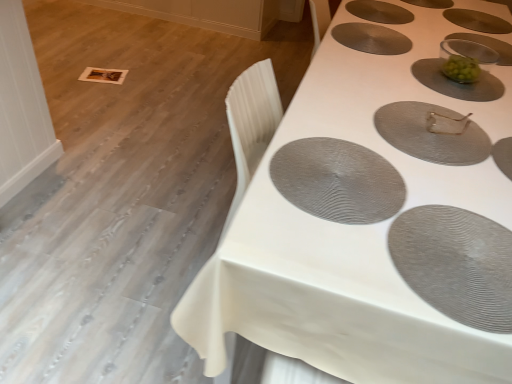
Question: Based on their positions, is green matte bowl at upper right, the 4th oval from the front, located to the left or right of gray textured placemat at lower right, the first oval from the front?

Choices:
 (A) right
 (B) left

Answer: (A)

Question: From a real-world perspective, relative to gray textured placemat at lower right, the first oval from the front, is green matte bowl at upper right, which is the fourth oval from back to front, vertically above or below?

Choices:
 (A) above
 (B) below

Answer: (B)

Question: Which object is the farthest from the matte gray placemat at center, which is the fifth oval in back-to-front order?

Choices:
 (A) matte gray placemat at upper center, which is the sixth oval in front-to-back order
 (B) white textured table at upper right
 (C) clear glass bowl at upper right
 (D) gray textured placemat at lower right, the first oval from the front
 (E) matte gray placemat at upper center, arranged as the third oval when viewed from the back

Answer: (A)

Question: Considering the real-world distances, which object is farthest from the matte gray placemat at upper center, which is the sixth oval in front-to-back order?

Choices:
 (A) clear glass bowl at upper right
 (B) green matte bowl at upper right, the 4th oval from the front
 (C) matte gray placemat at center, which is the fifth oval in back-to-front order
 (D) matte gray placemat at upper center, arranged as the third oval when viewed from the back
 (E) white textured table at upper right

Answer: (C)